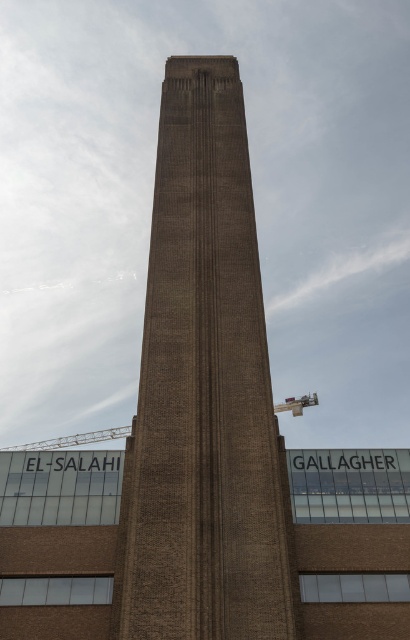
Question: Observing the image, what is the correct spatial positioning of brown brick tower at center in reference to metallic construction crane at center?

Choices:
 (A) right
 (B) left

Answer: (A)

Question: Which point is farther to the camera?

Choices:
 (A) (257, 605)
 (B) (309, 396)

Answer: (B)

Question: Which of the following is the closest to the observer?

Choices:
 (A) (125, 627)
 (B) (302, 410)

Answer: (A)

Question: Can you confirm if brown brick tower at center is thinner than metallic construction crane at center?

Choices:
 (A) no
 (B) yes

Answer: (B)

Question: Does brown brick tower at center lie behind metallic construction crane at center?

Choices:
 (A) no
 (B) yes

Answer: (A)

Question: Which of the following is the farthest from the observer?

Choices:
 (A) (184, 122)
 (B) (8, 449)

Answer: (B)